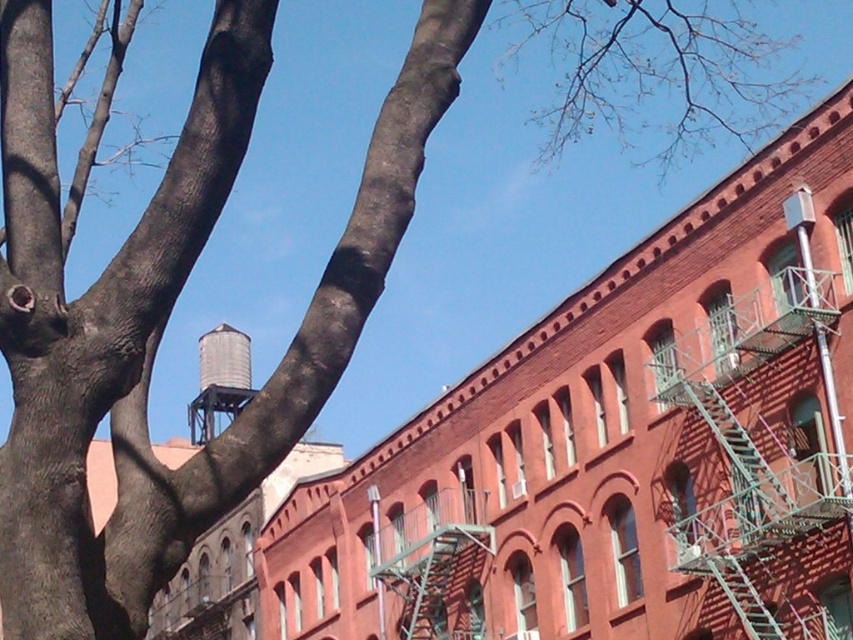
You are standing in front of the red brick building and want to determine the relative positions of two points marked on the facade. Which point, point [451,568] or point [210,353], is closer to you?

Point [451,568] is closer to the viewer than point [210,353].

You are standing at the base of the tree in the foreground and want to reach the green metal fire escape at center. According to the coordinates provided, in which direction should you move to reach it?

The green metal fire escape at center is located at coordinates point (428, 556). Since you are at the base of the tree in the foreground, you should move towards the center of the image to reach the fire escape.